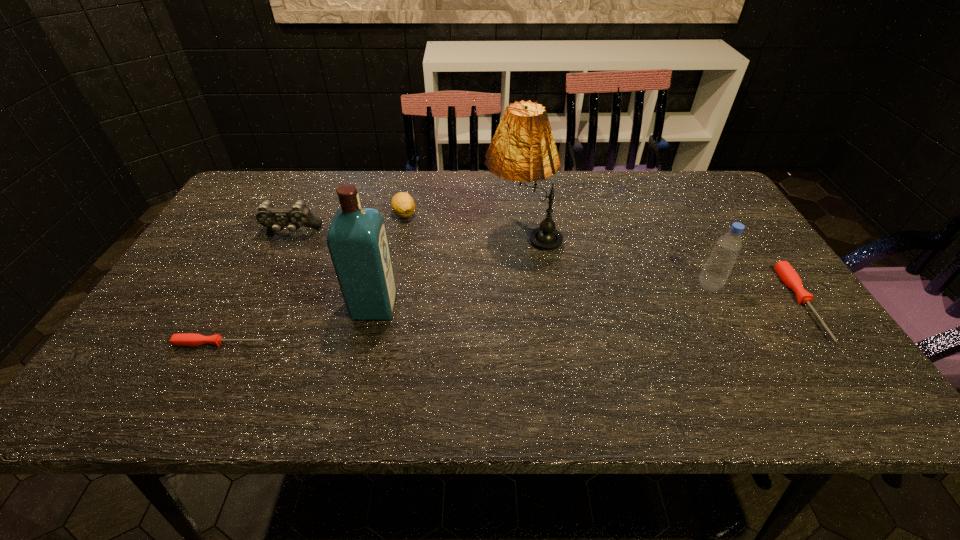
The height and width of the screenshot is (540, 960). In order to click on vacant space at the near right corner of the desktop in this screenshot , I will do `click(813, 339)`.

Find the location of a particular element. vacant space that is in between the fourth shortest object and the sixth tallest object is located at coordinates (547, 268).

Find the location of a particular element. vacant area that lies between the shorter screwdriver and the fifth tallest object is located at coordinates (313, 279).

The image size is (960, 540). Identify the location of blank region between the control and the lampshade. (407, 234).

Find the location of a particular element. Image resolution: width=960 pixels, height=540 pixels. free space between the third object from right to left and the right screwdriver is located at coordinates (662, 270).

Find the location of a particular element. free space between the bottle and the fifth object from left to right is located at coordinates (615, 261).

Find the location of a particular element. vacant point located between the lampshade and the liquor is located at coordinates (448, 271).

Identify the location of free space between the rightmost object and the liquor. The image size is (960, 540). (588, 305).

This screenshot has width=960, height=540. In order to click on vacant space in between the sixth object from left to right and the third shortest object in this screenshot , I will do tap(557, 249).

The image size is (960, 540). In order to click on free spot between the liquor and the third object from right to left in this screenshot , I will do `click(448, 271)`.